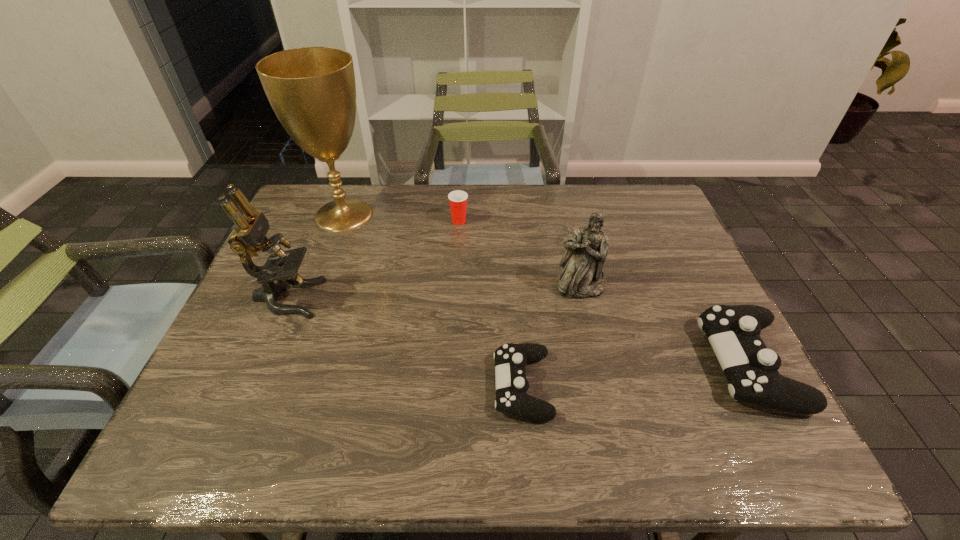
Where is `free region located on the surface of the shorter control`? This screenshot has width=960, height=540. free region located on the surface of the shorter control is located at coordinates (386, 386).

Locate an element on the screen. The height and width of the screenshot is (540, 960). vacant region located on the surface of the shorter control is located at coordinates (419, 386).

This screenshot has height=540, width=960. Find the location of `free location located on the surface of the rightmost object`. free location located on the surface of the rightmost object is located at coordinates (555, 364).

Where is `free region located on the surface of the rightmost object`? The image size is (960, 540). free region located on the surface of the rightmost object is located at coordinates (572, 364).

In order to click on free point located 0.140m on the surface of the rightmost object in this screenshot , I will do `click(644, 364)`.

You are a GUI agent. You are given a task and a screenshot of the screen. Output one action in this format:
    pyautogui.click(x=<x>, y=<y>)
    Task: Click on the vacant area situated 0.100m on the right of the trophy cup
    This screenshot has width=960, height=540.
    Given the screenshot: What is the action you would take?
    pyautogui.click(x=412, y=215)

Identify the location of free space located 0.190m on the left of the Dixie cup. Image resolution: width=960 pixels, height=540 pixels. (388, 221).

Image resolution: width=960 pixels, height=540 pixels. I want to click on vacant space positioned 0.190m on the front-facing side of the fourth shortest object, so click(x=597, y=362).

Locate an element on the screen. The width and height of the screenshot is (960, 540). free region located at the eyepieces of the microscope is located at coordinates (391, 298).

Find the location of a particular element. This screenshot has width=960, height=540. trophy cup that is positioned at the far edge is located at coordinates (312, 90).